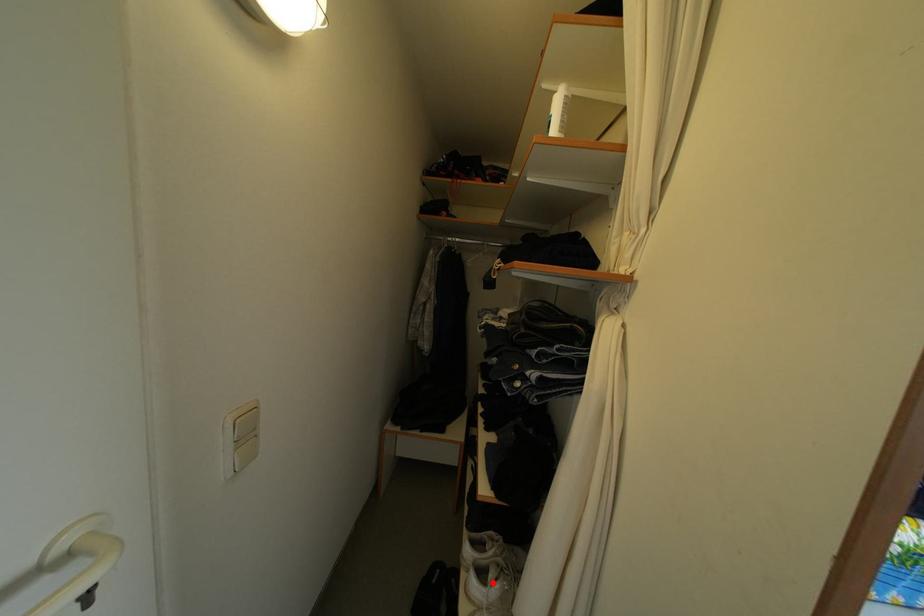
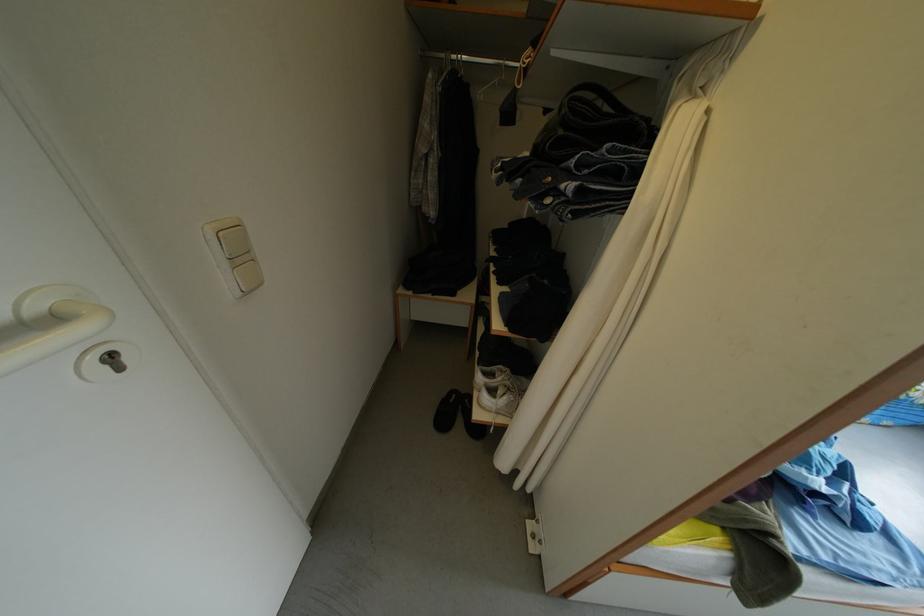
Find the pixel in the second image that matches the highlighted location in the first image.

(503, 400)